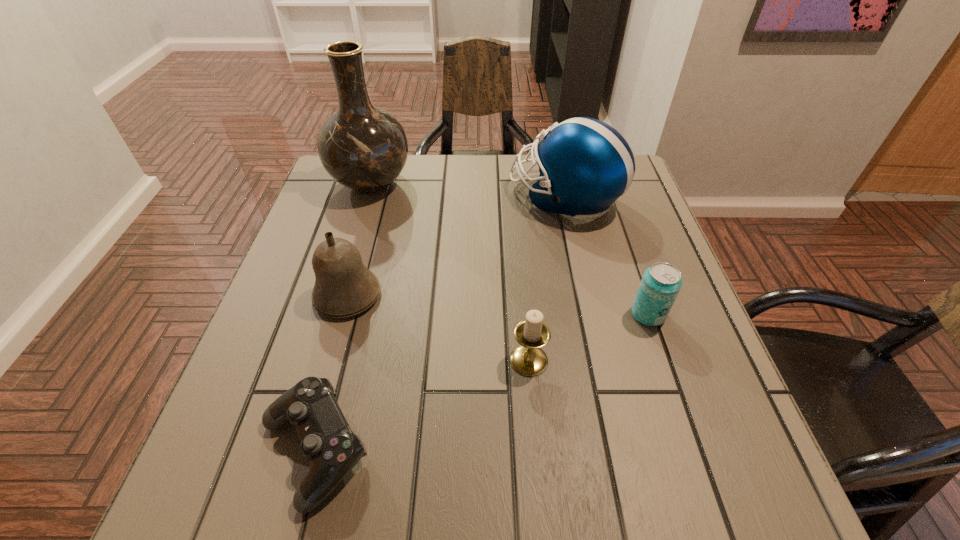
I want to click on blank space located at the front of the fifth shortest object with the faceguard, so click(x=408, y=198).

Locate an element on the screen. The height and width of the screenshot is (540, 960). free space located 0.240m on the front of the bell is located at coordinates (308, 438).

The width and height of the screenshot is (960, 540). I want to click on vacant area situated 0.280m on the back of the fifth farthest object, so pos(518,247).

You are a GUI agent. You are given a task and a screenshot of the screen. Output one action in this format:
    pyautogui.click(x=<x>, y=<y>)
    Task: Click on the vacant region located on the back of the beer can
    
    Given the screenshot: What is the action you would take?
    pos(612,208)

At what (x,y) coordinates should I click in order to perform the action: click on vacant space located 0.150m on the back of the nearest object. Please return your answer as a coordinate pair (x, y). The width and height of the screenshot is (960, 540). Looking at the image, I should click on (348, 326).

Image resolution: width=960 pixels, height=540 pixels. Find the location of `vase that is at the far edge`. vase that is at the far edge is located at coordinates (363, 147).

Locate an element on the screen. This screenshot has height=540, width=960. football helmet that is at the far edge is located at coordinates (585, 165).

Find the location of a particular element. This screenshot has width=960, height=540. object located in the near edge section of the desktop is located at coordinates (327, 442).

You are a GUI agent. You are given a task and a screenshot of the screen. Output one action in this format:
    pyautogui.click(x=<x>, y=<y>)
    Task: Click on the vase that is at the left edge
    
    Given the screenshot: What is the action you would take?
    pyautogui.click(x=363, y=147)

I want to click on bell at the left edge, so click(344, 287).